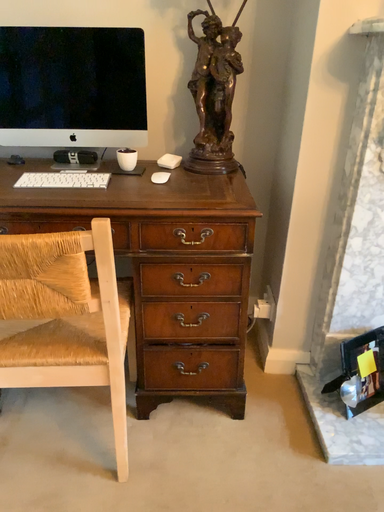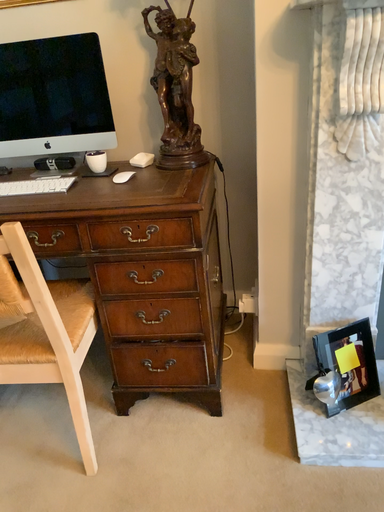
Question: How did the camera likely rotate when shooting the video?

Choices:
 (A) rotated right
 (B) rotated left

Answer: (B)